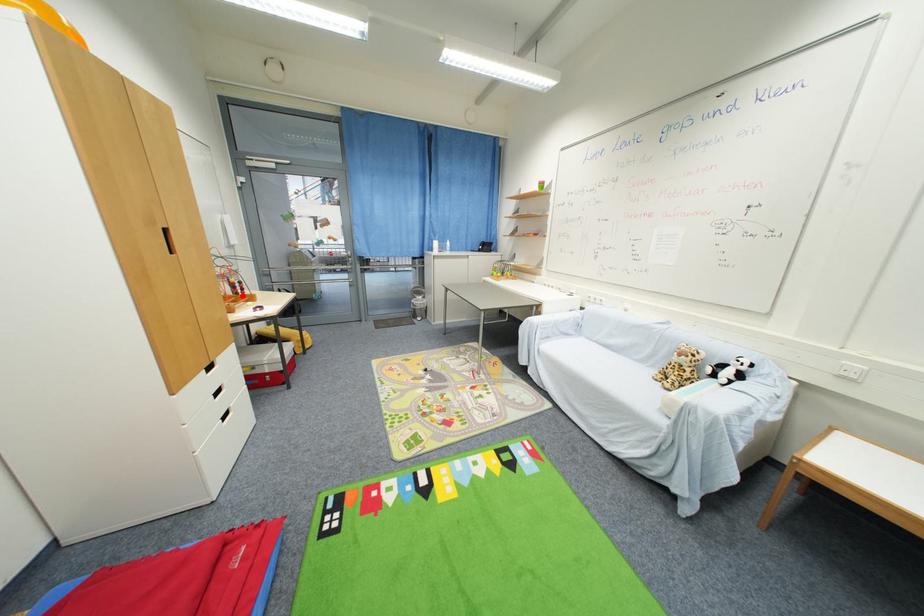
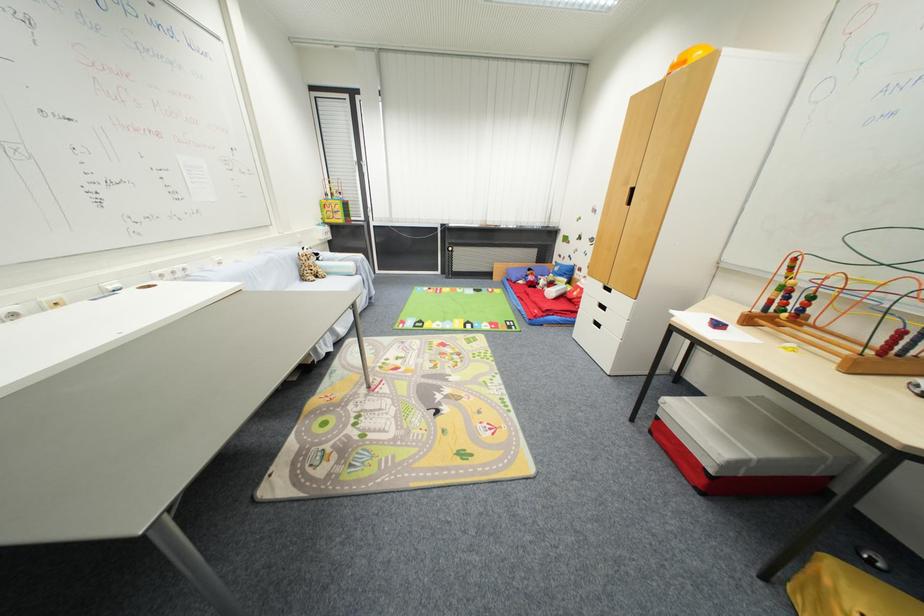
Question: I am providing you with two images of the same scene from different viewpoints. A red point is shown in image1. For the corresponding object point in image2, is it positioned nearer or farther from the camera?

Choices:
 (A) Nearer
 (B) Farther

Answer: (B)